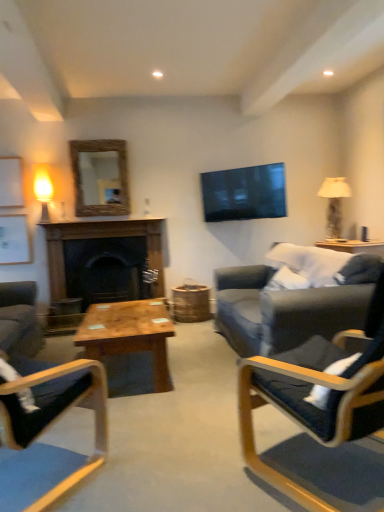
Question: From a real-world perspective, is white fabric lampshade at right, positioned as the 2th lamp in left-to-right order, positioned over wooden coffee table at center based on gravity?

Choices:
 (A) yes
 (B) no

Answer: (A)

Question: Is the position of white fabric lampshade at right, which is the 1th lamp in right-to-left order, less distant than that of wooden coffee table at center?

Choices:
 (A) no
 (B) yes

Answer: (A)

Question: Does white fabric lampshade at right, positioned as the 2th lamp in left-to-right order, have a larger size compared to wooden coffee table at center?

Choices:
 (A) no
 (B) yes

Answer: (A)

Question: Is wooden coffee table at center inside white fabric lampshade at right, which is the 1th lamp in right-to-left order?

Choices:
 (A) yes
 (B) no

Answer: (B)

Question: Does white fabric lampshade at right, which is the 1th lamp in right-to-left order, appear on the left side of wooden coffee table at center?

Choices:
 (A) no
 (B) yes

Answer: (A)

Question: From a real-world perspective, is matte black chair at right, placed as the 1th chair when sorted from right to left, physically located above or below white fabric lampshade at right, which is the 1th lamp in right-to-left order?

Choices:
 (A) below
 (B) above

Answer: (A)

Question: From their relative heights in the image, would you say matte black chair at right, the second chair viewed from the left, is taller or shorter than white fabric lampshade at right, positioned as the 2th lamp in left-to-right order?

Choices:
 (A) tall
 (B) short

Answer: (A)

Question: Considering their positions, is matte black chair at right, placed as the 1th chair when sorted from right to left, located in front of or behind white fabric lampshade at right, positioned as the 2th lamp in left-to-right order?

Choices:
 (A) front
 (B) behind

Answer: (A)

Question: Is matte black chair at right, the second chair viewed from the left, bigger or smaller than white fabric lampshade at right, positioned as the 2th lamp in left-to-right order?

Choices:
 (A) big
 (B) small

Answer: (A)

Question: From their relative heights in the image, would you say dark wood fireplace at center is taller or shorter than rustic wood mirror at upper center?

Choices:
 (A) short
 (B) tall

Answer: (B)

Question: Considering the positions of dark wood fireplace at center and rustic wood mirror at upper center in the image, is dark wood fireplace at center bigger or smaller than rustic wood mirror at upper center?

Choices:
 (A) small
 (B) big

Answer: (B)

Question: Is dark wood fireplace at center wider or thinner than rustic wood mirror at upper center?

Choices:
 (A) wide
 (B) thin

Answer: (A)

Question: Based on their positions, is dark wood fireplace at center located to the left or right of rustic wood mirror at upper center?

Choices:
 (A) right
 (B) left

Answer: (A)

Question: Visually, is matte glass lamp at left, which is the first lamp from left to right, positioned to the left or to the right of rustic wood mirror at upper center?

Choices:
 (A) right
 (B) left

Answer: (B)

Question: Is matte glass lamp at left, placed as the 2th lamp when sorted from right to left, taller or shorter than rustic wood mirror at upper center?

Choices:
 (A) short
 (B) tall

Answer: (A)